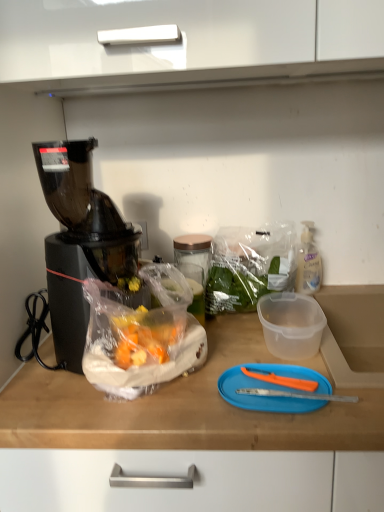
Question: Which is correct: translucent plastic bag at center is inside black plastic blender at left, or outside of it?

Choices:
 (A) inside
 (B) outside

Answer: (B)

Question: Considering the positions of translucent plastic bag at center and black plastic blender at left in the image, is translucent plastic bag at center bigger or smaller than black plastic blender at left?

Choices:
 (A) small
 (B) big

Answer: (A)

Question: Based on their relative distances, which object is nearer to the translucent plastic bag at center?

Choices:
 (A) clear plastic bottle at right
 (B) black plastic blender at left
 (C) blue plastic cutting board at center

Answer: (A)

Question: Which is farther from the blue plastic cutting board at center?

Choices:
 (A) black plastic blender at left
 (B) translucent plastic bag at center
 (C) clear plastic bottle at right

Answer: (C)